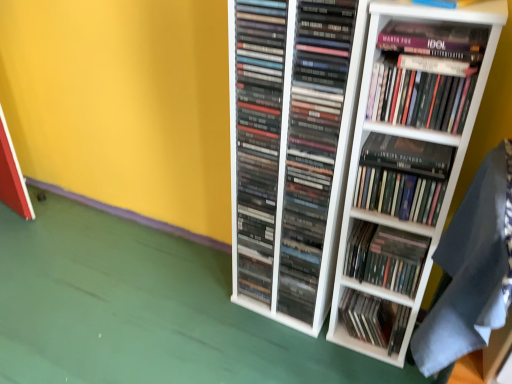
Find the location of `blank space to the left of matte black books at center, which appears as the fifth book when viewed from the top`. blank space to the left of matte black books at center, which appears as the fifth book when viewed from the top is located at coordinates (243, 318).